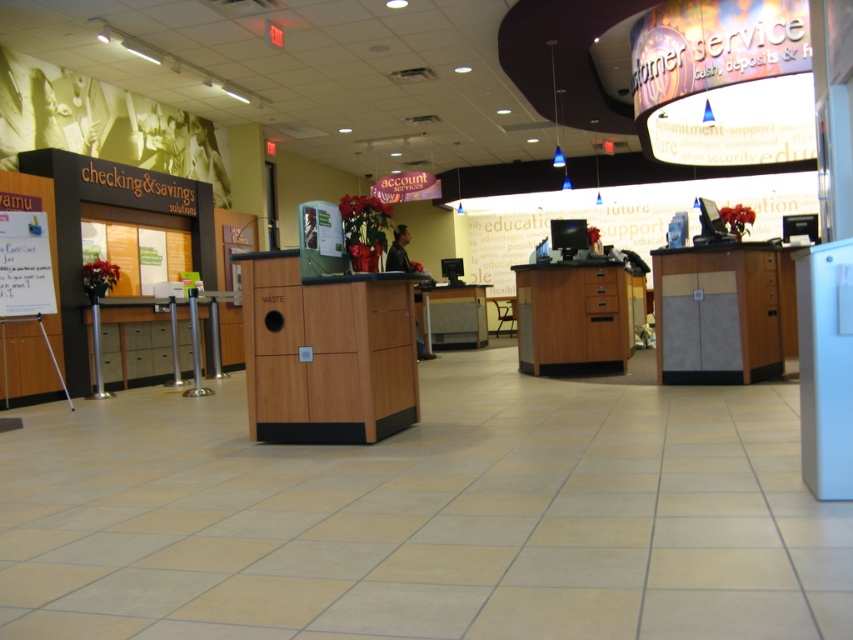
You are a customer service representative who needs to place a document on the wooden cabinet at center and the matte wood desk at right. Which surface is closer to the entrance of the bank?

The wooden cabinet at center is closer to the entrance of the bank because it is positioned to the left of the matte wood desk at right, implying it is nearer to the entrance in the spatial layout.

You are a customer service representative who needs to deliver a document to the manager. The manager is seated at the wooden desk at center. You are currently standing at the matte wood desk at right. Can you walk directly to the manager without moving any furniture?

The matte wood desk at right is in front of the wooden desk at center, so you cannot walk directly to the manager without moving the matte wood desk at right.